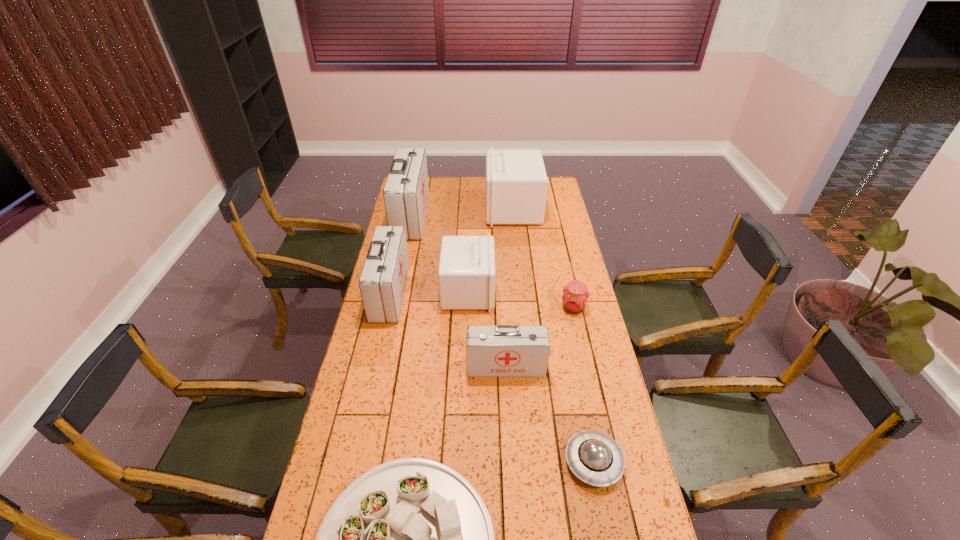
You are a GUI agent. You are given a task and a screenshot of the screen. Output one action in this format:
    pyautogui.click(x=<x>, y=<y>)
    Task: Click on the free space located 0.220m on the front-facing side of the farther white first-aid kit
    The image size is (960, 540).
    Given the screenshot: What is the action you would take?
    pyautogui.click(x=444, y=209)

Find the location of a particular element. Image resolution: width=960 pixels, height=540 pixels. blank space located 0.300m on the front-facing side of the farther white first-aid kit is located at coordinates (428, 209).

Find the location of `free space located 0.250m on the front-facing side of the biggest red first-aid kit`. free space located 0.250m on the front-facing side of the biggest red first-aid kit is located at coordinates (474, 215).

Where is `blank space located on the front-facing side of the smaller white first-aid kit`? This screenshot has height=540, width=960. blank space located on the front-facing side of the smaller white first-aid kit is located at coordinates (544, 291).

Locate an element on the screen. free space located 0.190m on the front-facing side of the second biggest red first-aid kit is located at coordinates (450, 293).

Where is `free space located on the front-facing side of the smallest red first-aid kit`? free space located on the front-facing side of the smallest red first-aid kit is located at coordinates (511, 456).

Where is `free region located on the front of the red jam`? The height and width of the screenshot is (540, 960). free region located on the front of the red jam is located at coordinates coord(595,403).

Identify the location of free region located on the back of the saucer. (573, 359).

Image resolution: width=960 pixels, height=540 pixels. I want to click on the first-aid kit located in the right edge section of the desktop, so click(516, 182).

This screenshot has width=960, height=540. Find the location of `jam that is positioned at the right edge`. jam that is positioned at the right edge is located at coordinates (574, 300).